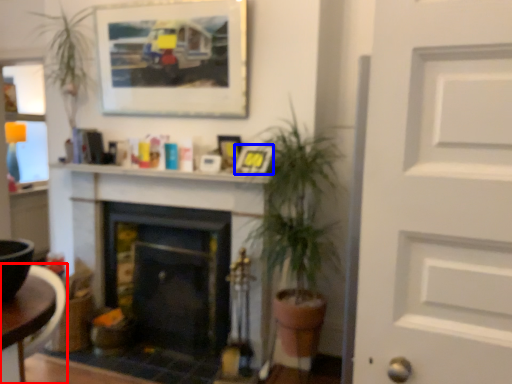
Question: Which of the following is the closest to the observer, table (highlighted by a red box) or picture frame (highlighted by a blue box)?

Choices:
 (A) table
 (B) picture frame

Answer: (A)